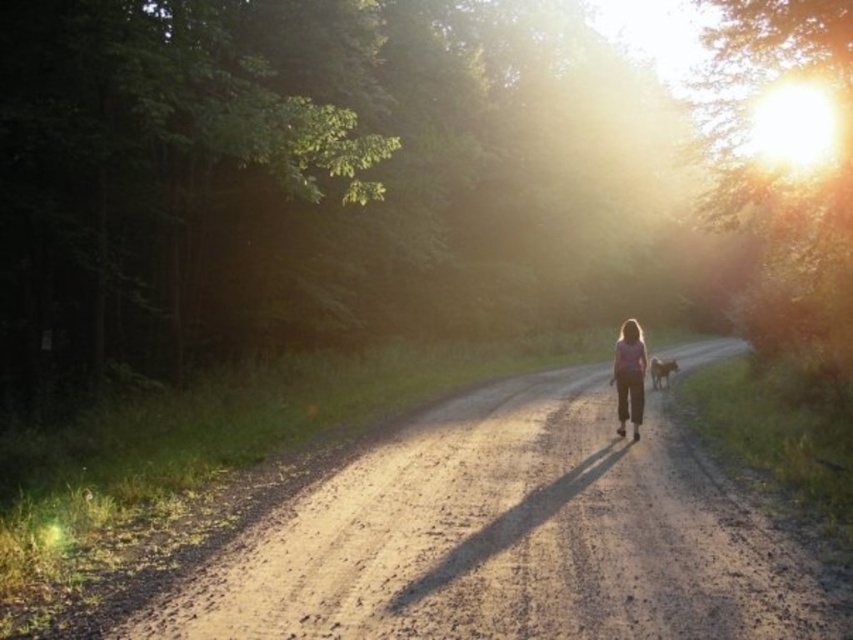
Who is more forward, (595, 387) or (625, 358)?

Point (625, 358) is in front.

Is dusty gravel road at center to the left of pink fabric girl at center from the viewer's perspective?

Yes, dusty gravel road at center is to the left of pink fabric girl at center.

Find the location of a particular element. This screenshot has height=640, width=853. dusty gravel road at center is located at coordinates (508, 538).